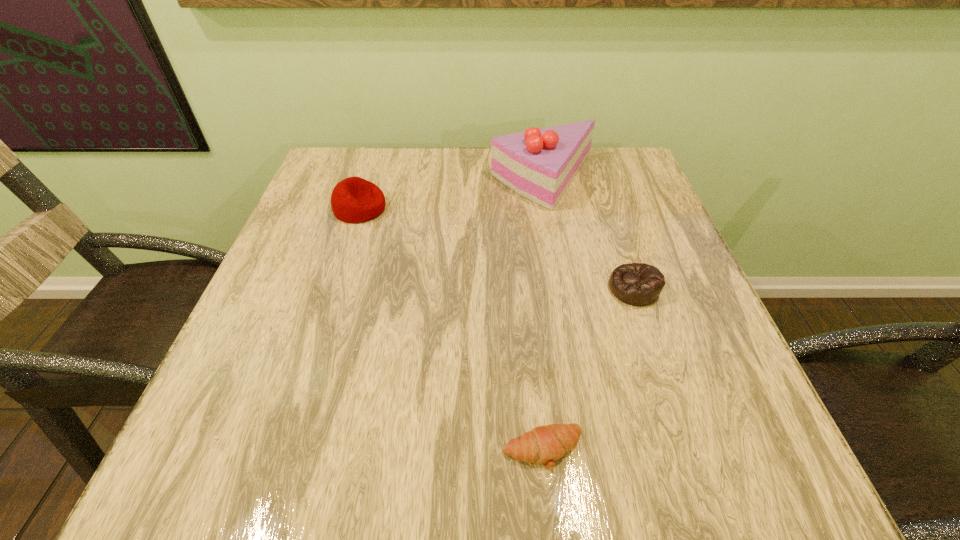
You are a GUI agent. You are given a task and a screenshot of the screen. Output one action in this format:
    pyautogui.click(x=<x>, y=<y>)
    Task: Click on the vacant region that satisfies the following two spatial constraints: 1. on the seat area of the shorter beanbag; 2. on the right side of the third shortest object
    This screenshot has width=960, height=540.
    Given the screenshot: What is the action you would take?
    [334, 288]

At what (x,y) coordinates should I click in order to perform the action: click on vacant region that satisfies the following two spatial constraints: 1. on the seat area of the taller beanbag; 2. on the left side of the shortest object. Please return your answer as a coordinate pair (x, y). The height and width of the screenshot is (540, 960). Looking at the image, I should click on (282, 450).

Where is `free region that satisfies the following two spatial constraints: 1. on the back side of the nearer beanbag; 2. on the seat area of the leftmost object`? Image resolution: width=960 pixels, height=540 pixels. free region that satisfies the following two spatial constraints: 1. on the back side of the nearer beanbag; 2. on the seat area of the leftmost object is located at coordinates (607, 208).

This screenshot has height=540, width=960. Find the location of `vacant space that satisfies the following two spatial constraints: 1. on the seat area of the leftmost object; 2. on the right side of the right beanbag`. vacant space that satisfies the following two spatial constraints: 1. on the seat area of the leftmost object; 2. on the right side of the right beanbag is located at coordinates (334, 288).